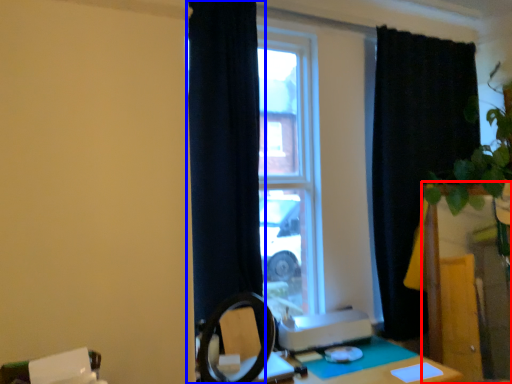
Question: Which point is closer to the camera, vanity (highlighted by a red box) or curtain (highlighted by a blue box)?

Choices:
 (A) vanity
 (B) curtain

Answer: (B)